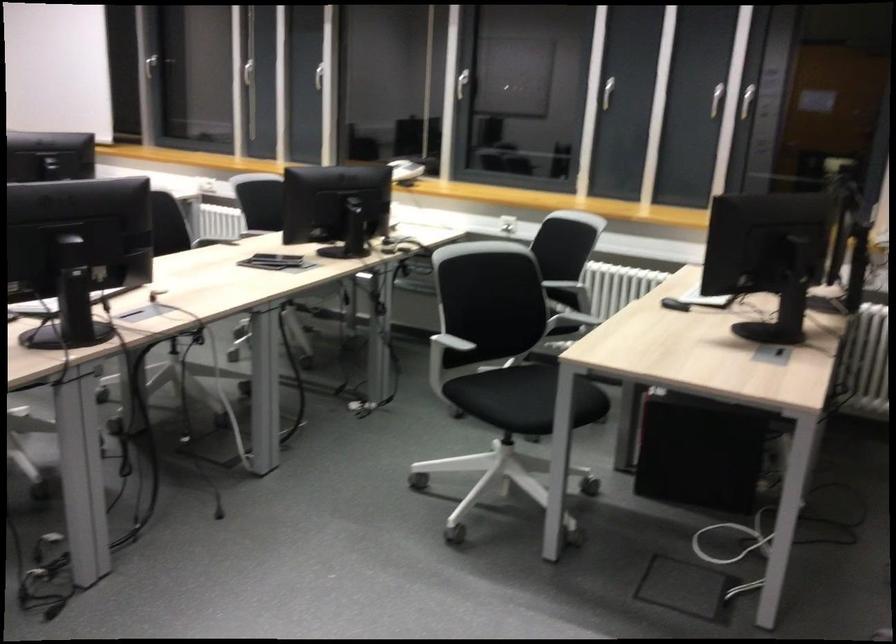
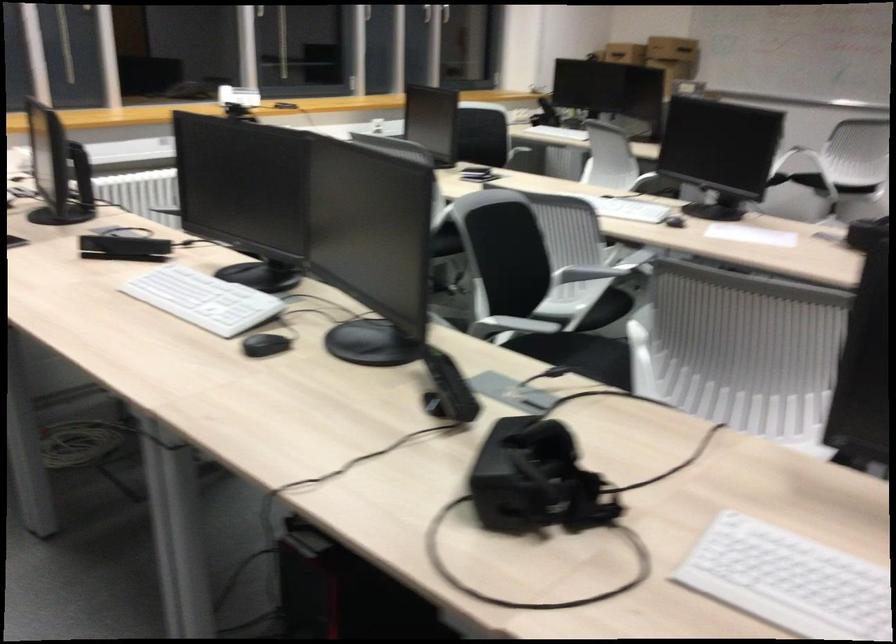
Question: I am providing you with two images of the same scene from different viewpoints. Which of the following objects are not visible in image2?

Choices:
 (A) computer mouse
 (B) black computer mouse
 (C) small blue box
 (D) white webcam

Answer: (A)